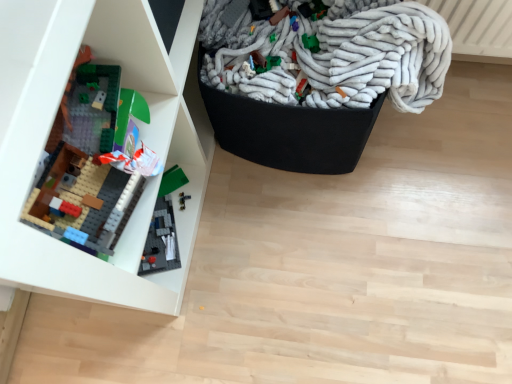
Question: From a real-world perspective, is matte plastic lego set at left positioned above or below white fuzzy blanket at upper right?

Choices:
 (A) below
 (B) above

Answer: (B)

Question: From the image's perspective, is matte plastic lego set at left positioned above or below white fuzzy blanket at upper right?

Choices:
 (A) below
 (B) above

Answer: (A)

Question: Considering the positions of matte plastic lego set at left and white fuzzy blanket at upper right in the image, is matte plastic lego set at left taller or shorter than white fuzzy blanket at upper right?

Choices:
 (A) short
 (B) tall

Answer: (B)

Question: From the image's perspective, is white fuzzy blanket at upper right above or below matte plastic lego set at left?

Choices:
 (A) above
 (B) below

Answer: (A)

Question: Looking at their shapes, would you say white fuzzy blanket at upper right is wider or thinner than matte plastic lego set at left?

Choices:
 (A) wide
 (B) thin

Answer: (A)

Question: Is point (323, 36) closer or farther from the camera than point (185, 243)?

Choices:
 (A) farther
 (B) closer

Answer: (B)

Question: Based on their positions, is white fuzzy blanket at upper right located to the left or right of matte plastic lego set at left?

Choices:
 (A) right
 (B) left

Answer: (A)